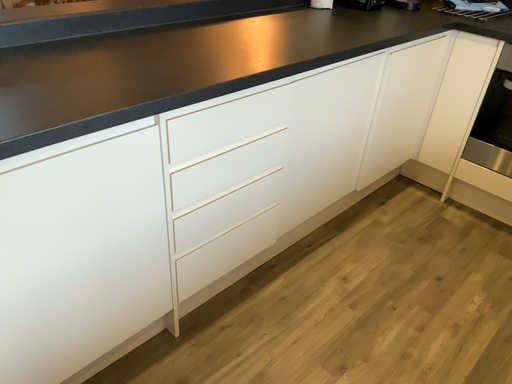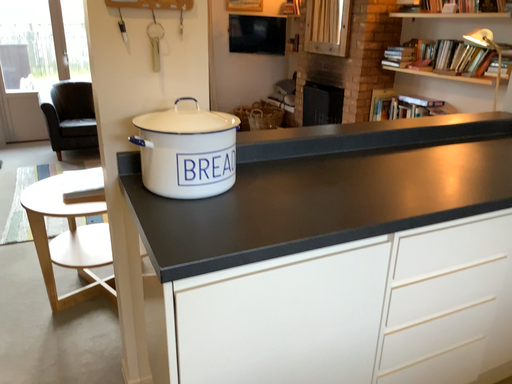
Question: Which way did the camera rotate in the video?

Choices:
 (A) rotated right
 (B) rotated left

Answer: (B)